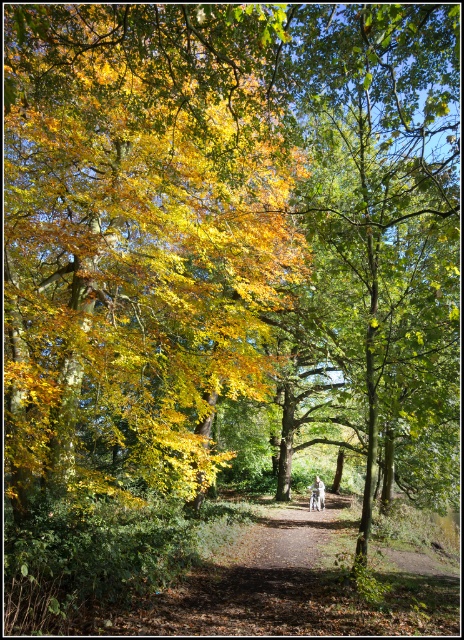
You are standing on the dirt trail in the forest and see both the golden yellow leaves at center and the white cotton shirt at center. Which object is nearer to you?

The golden yellow leaves at center are closer to the viewer than the white cotton shirt at center, so the golden yellow leaves at center is nearer to you.